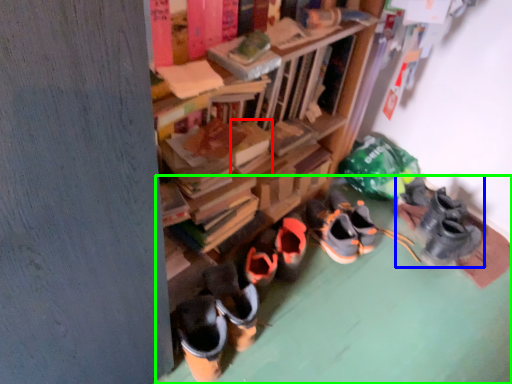
Question: Which is nearer to the book (highlighted by a red box)? footwear (highlighted by a blue box) or concrete (highlighted by a green box).

Choices:
 (A) footwear
 (B) concrete

Answer: (B)